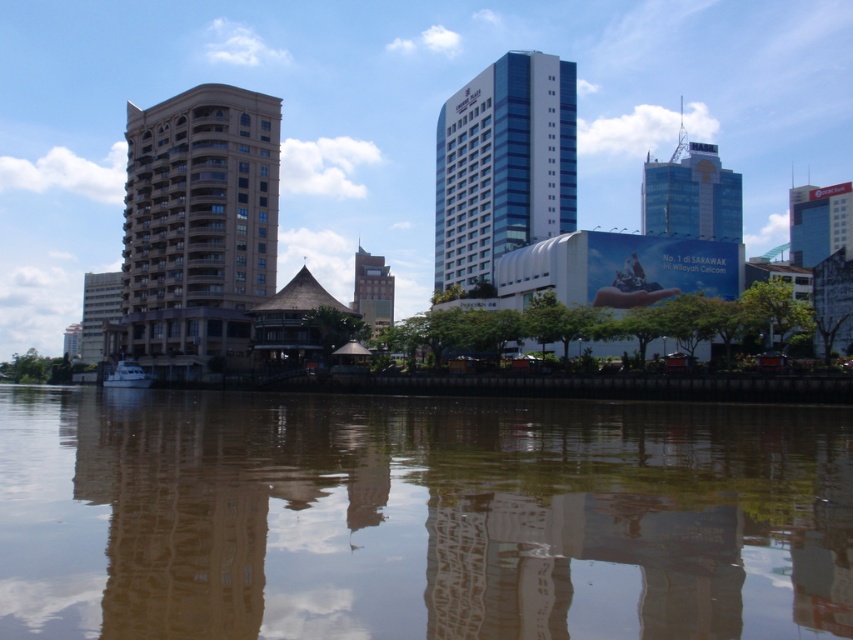
Does blue glass building at upper center have a lesser height compared to green glass tower at center?

No.

How far apart are blue glass building at upper center and green glass tower at center?

blue glass building at upper center and green glass tower at center are 85.05 meters apart from each other.

This screenshot has height=640, width=853. What are the coordinates of `blue glass building at upper center` in the screenshot? It's located at (691, 196).

Between beige stone building at center and white matte boat at lower left, which one has less height?

white matte boat at lower left

Is beige stone building at center shorter than white matte boat at lower left?

Incorrect, beige stone building at center's height does not fall short of white matte boat at lower left's.

Which is in front, point (241, 243) or point (122, 380)?

Point (122, 380)

Where is `beige stone building at center`? The height and width of the screenshot is (640, 853). beige stone building at center is located at coordinates (196, 228).

Can you confirm if transparent water at center is bigger than blue glass building at upper center?

No, transparent water at center is not bigger than blue glass building at upper center.

In order to click on transparent water at center in this screenshot , I will do `click(418, 516)`.

Find the location of a particular element. transparent water at center is located at coordinates (418, 516).